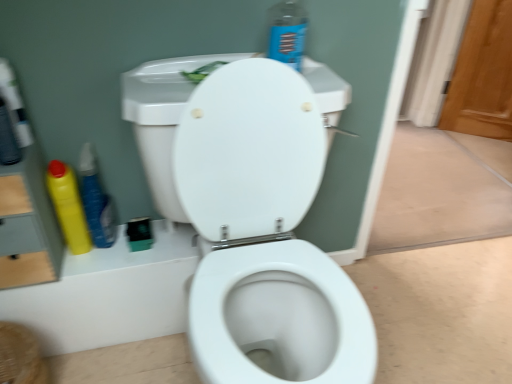
Locate an element on the screen. Image resolution: width=512 pixels, height=384 pixels. vacant area that lies in front of yellow plastic bottle at left, which appears as the 3th cleaning product when viewed from the right is located at coordinates (68, 270).